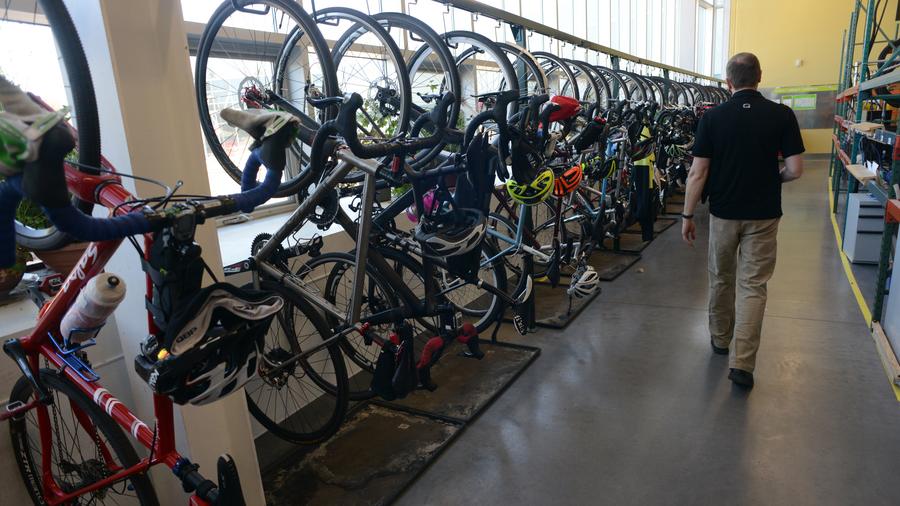
At what (x,y) coordinates should I click in order to perform the action: click on window. Please return your answer as a coordinate pair (x, y). Image resolution: width=900 pixels, height=506 pixels. Looking at the image, I should click on (217, 159).